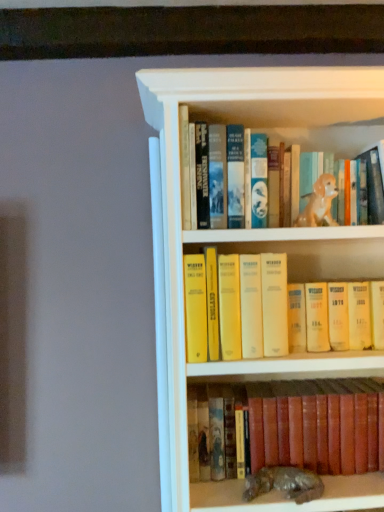
The image size is (384, 512). Identify the location of golden ceramic dog at upper center, which is the 2th animal in bottom-to-top order. (319, 203).

Considering the relative sizes of golden ceramic dog at upper center, acting as the 1th animal starting from the top, and shiny metallic statue at lower center, which is the 1th animal in bottom-to-top order, in the image provided, is golden ceramic dog at upper center, acting as the 1th animal starting from the top, shorter than shiny metallic statue at lower center, which is the 1th animal in bottom-to-top order,?

In fact, golden ceramic dog at upper center, acting as the 1th animal starting from the top, may be taller than shiny metallic statue at lower center, which is the 1th animal in bottom-to-top order.

Where is `animal lying in front of the shiny metallic statue at lower center, which is the second animal in top-to-bottom order`? The image size is (384, 512). animal lying in front of the shiny metallic statue at lower center, which is the second animal in top-to-bottom order is located at coordinates (319, 203).

From the picture: Does golden ceramic dog at upper center, which is the 2th animal in bottom-to-top order, lie in front of shiny metallic statue at lower center, which is the 1th animal in bottom-to-top order?

Yes, it is.

Which is more to the right, golden ceramic dog at upper center, acting as the 1th animal starting from the top, or shiny metallic statue at lower center, which is the 1th animal in bottom-to-top order?

From the viewer's perspective, golden ceramic dog at upper center, acting as the 1th animal starting from the top, appears more on the right side.

From a real-world perspective, is shiny metallic statue at lower center, which is the second animal in top-to-bottom order, positioned above or below golden ceramic dog at upper center, acting as the 1th animal starting from the top?

From a real-world perspective, shiny metallic statue at lower center, which is the second animal in top-to-bottom order, is physically below golden ceramic dog at upper center, acting as the 1th animal starting from the top.

Is golden ceramic dog at upper center, which is the 2th animal in bottom-to-top order, completely or partially inside shiny metallic statue at lower center, which is the second animal in top-to-bottom order?

No.

Identify the location of animal in front of the shiny metallic statue at lower center, which is the second animal in top-to-bottom order. (319, 203).

From the image's perspective, which is below, shiny metallic statue at lower center, which is the second animal in top-to-bottom order, or golden ceramic dog at upper center, which is the 2th animal in bottom-to-top order?

From the image's view, shiny metallic statue at lower center, which is the second animal in top-to-bottom order, is below.

Does shiny metallic statue at lower center, which is the second animal in top-to-bottom order, have a lesser width compared to yellow paperbacks at center, acting as the first book starting from the top?

Yes, shiny metallic statue at lower center, which is the second animal in top-to-bottom order, is thinner than yellow paperbacks at center, acting as the first book starting from the top.

Is point (293, 490) closer to camera compared to point (234, 347)?

No, (293, 490) is behind (234, 347).

From the picture: Is shiny metallic statue at lower center, which is the second animal in top-to-bottom order, facing towards yellow paperbacks at center, the 2th book positioned from the bottom?

No, shiny metallic statue at lower center, which is the second animal in top-to-bottom order, does not turn towards yellow paperbacks at center, the 2th book positioned from the bottom.

From a real-world perspective, who is located higher, shiny metallic statue at lower center, which is the second animal in top-to-bottom order, or yellow paperbacks at center, acting as the first book starting from the top?

yellow paperbacks at center, acting as the first book starting from the top, from a real-world perspective.

From a real-world perspective, is leather-bound book at lower center, which ranks as the second book in top-to-bottom order, located higher than golden ceramic dog at upper center, which is the 2th animal in bottom-to-top order?

No, from a real-world perspective, leather-bound book at lower center, which ranks as the second book in top-to-bottom order, is not over golden ceramic dog at upper center, which is the 2th animal in bottom-to-top order

Considering the positions of objects leather-bound book at lower center, which is the 1th book in bottom-to-top order, and golden ceramic dog at upper center, acting as the 1th animal starting from the top, in the image provided, who is more to the right, leather-bound book at lower center, which is the 1th book in bottom-to-top order, or golden ceramic dog at upper center, acting as the 1th animal starting from the top,?

From the viewer's perspective, golden ceramic dog at upper center, acting as the 1th animal starting from the top, appears more on the right side.

From a real-world perspective, starting from the golden ceramic dog at upper center, acting as the 1th animal starting from the top, which book is the 2nd one below it? Please provide its 2D coordinates.

[(317, 425)]

Does leather-bound book at lower center, which ranks as the second book in top-to-bottom order, have a larger size compared to golden ceramic dog at upper center, which is the 2th animal in bottom-to-top order?

Yes, leather-bound book at lower center, which ranks as the second book in top-to-bottom order, is bigger than golden ceramic dog at upper center, which is the 2th animal in bottom-to-top order.

Between yellow paperbacks at center, acting as the first book starting from the top, and leather-bound book at lower center, which is the 1th book in bottom-to-top order, which one is positioned behind?

leather-bound book at lower center, which is the 1th book in bottom-to-top order, is behind.

Would you say yellow paperbacks at center, acting as the first book starting from the top, is a long distance from leather-bound book at lower center, which ranks as the second book in top-to-bottom order?

Actually, yellow paperbacks at center, acting as the first book starting from the top, and leather-bound book at lower center, which ranks as the second book in top-to-bottom order, are a little close together.

Is yellow paperbacks at center, acting as the first book starting from the top, facing towards leather-bound book at lower center, which ranks as the second book in top-to-bottom order?

No.

Looking at this image, from a real-world perspective, between yellow paperbacks at center, acting as the first book starting from the top, and leather-bound book at lower center, which is the 1th book in bottom-to-top order, who is vertically lower?

leather-bound book at lower center, which is the 1th book in bottom-to-top order, is physically lower.

From a real-world perspective, which is physically below, shiny metallic statue at lower center, which is the second animal in top-to-bottom order, or leather-bound book at lower center, which is the 1th book in bottom-to-top order?

shiny metallic statue at lower center, which is the second animal in top-to-bottom order, from a real-world perspective.

You are a GUI agent. You are given a task and a screenshot of the screen. Output one action in this format:
    pyautogui.click(x=<x>, y=<y>)
    Task: Click on the 1st book above the shiny metallic statue at lower center, which is the second animal in top-to-bottom order (from the image's perspective)
    
    Given the screenshot: What is the action you would take?
    pyautogui.click(x=317, y=425)

From the image's perspective, does shiny metallic statue at lower center, which is the second animal in top-to-bottom order, appear lower than leather-bound book at lower center, which ranks as the second book in top-to-bottom order?

Yes, from the image's perspective, shiny metallic statue at lower center, which is the second animal in top-to-bottom order, is beneath leather-bound book at lower center, which ranks as the second book in top-to-bottom order.

Which of these two, shiny metallic statue at lower center, which is the second animal in top-to-bottom order, or leather-bound book at lower center, which is the 1th book in bottom-to-top order, stands shorter?

shiny metallic statue at lower center, which is the second animal in top-to-bottom order.

Choose the correct answer: Is yellow paperbacks at center, acting as the first book starting from the top, inside shiny metallic statue at lower center, which is the second animal in top-to-bottom order, or outside it?

yellow paperbacks at center, acting as the first book starting from the top, is not inside shiny metallic statue at lower center, which is the second animal in top-to-bottom order, it's outside.

Consider the image. From the image's perspective, which one is positioned higher, yellow paperbacks at center, acting as the first book starting from the top, or shiny metallic statue at lower center, which is the 1th animal in bottom-to-top order?

yellow paperbacks at center, acting as the first book starting from the top, from the image's perspective.

The width and height of the screenshot is (384, 512). I want to click on animal below the yellow paperbacks at center, the 2th book positioned from the bottom (from the image's perspective), so click(x=284, y=483).

Is yellow paperbacks at center, the 2th book positioned from the bottom, to the left or to the right of shiny metallic statue at lower center, which is the second animal in top-to-bottom order, in the image?

yellow paperbacks at center, the 2th book positioned from the bottom, is positioned on shiny metallic statue at lower center, which is the second animal in top-to-bottom order,'s left side.

This screenshot has height=512, width=384. I want to click on animal on the left of golden ceramic dog at upper center, acting as the 1th animal starting from the top, so click(x=284, y=483).

Locate an element on the screen. animal below the golden ceramic dog at upper center, acting as the 1th animal starting from the top (from the image's perspective) is located at coordinates (284, 483).

Which object lies further to the anchor point leather-bound book at lower center, which is the 1th book in bottom-to-top order, golden ceramic dog at upper center, which is the 2th animal in bottom-to-top order, or shiny metallic statue at lower center, which is the 1th animal in bottom-to-top order?

Among the two, golden ceramic dog at upper center, which is the 2th animal in bottom-to-top order, is located further to leather-bound book at lower center, which is the 1th book in bottom-to-top order.

Consider the image. Which object lies nearer to the anchor point shiny metallic statue at lower center, which is the 1th animal in bottom-to-top order, yellow paperbacks at center, the 2th book positioned from the bottom, or golden ceramic dog at upper center, acting as the 1th animal starting from the top?

Among the two, yellow paperbacks at center, the 2th book positioned from the bottom, is located nearer to shiny metallic statue at lower center, which is the 1th animal in bottom-to-top order.

Estimate the real-world distances between objects in this image. Which object is closer to leather-bound book at lower center, which is the 1th book in bottom-to-top order, shiny metallic statue at lower center, which is the 1th animal in bottom-to-top order, or golden ceramic dog at upper center, which is the 2th animal in bottom-to-top order?

shiny metallic statue at lower center, which is the 1th animal in bottom-to-top order, lies closer to leather-bound book at lower center, which is the 1th book in bottom-to-top order, than the other object.

Based on their spatial positions, is shiny metallic statue at lower center, which is the second animal in top-to-bottom order, or leather-bound book at lower center, which is the 1th book in bottom-to-top order, closer to golden ceramic dog at upper center, acting as the 1th animal starting from the top?

Based on the image, leather-bound book at lower center, which is the 1th book in bottom-to-top order, appears to be nearer to golden ceramic dog at upper center, acting as the 1th animal starting from the top.

Consider the image. From the image, which object appears to be farther from golden ceramic dog at upper center, acting as the 1th animal starting from the top, shiny metallic statue at lower center, which is the second animal in top-to-bottom order, or yellow paperbacks at center, acting as the first book starting from the top?

Among the two, shiny metallic statue at lower center, which is the second animal in top-to-bottom order, is located further to golden ceramic dog at upper center, acting as the 1th animal starting from the top.

Considering their positions, is shiny metallic statue at lower center, which is the 1th animal in bottom-to-top order, positioned closer to yellow paperbacks at center, acting as the first book starting from the top, than leather-bound book at lower center, which is the 1th book in bottom-to-top order?

leather-bound book at lower center, which is the 1th book in bottom-to-top order, is closer to yellow paperbacks at center, acting as the first book starting from the top.

Looking at the image, which one is located closer to golden ceramic dog at upper center, which is the 2th animal in bottom-to-top order, leather-bound book at lower center, which ranks as the second book in top-to-bottom order, or shiny metallic statue at lower center, which is the 1th animal in bottom-to-top order?

leather-bound book at lower center, which ranks as the second book in top-to-bottom order, is closer to golden ceramic dog at upper center, which is the 2th animal in bottom-to-top order.

Considering their positions, is golden ceramic dog at upper center, acting as the 1th animal starting from the top, positioned further to leather-bound book at lower center, which ranks as the second book in top-to-bottom order, than yellow paperbacks at center, the 2th book positioned from the bottom?

The object further to leather-bound book at lower center, which ranks as the second book in top-to-bottom order, is golden ceramic dog at upper center, acting as the 1th animal starting from the top.

Image resolution: width=384 pixels, height=512 pixels. I want to click on book between golden ceramic dog at upper center, which is the 2th animal in bottom-to-top order, and leather-bound book at lower center, which is the 1th book in bottom-to-top order, in the vertical direction, so click(x=334, y=311).

At what (x,y) coordinates should I click in order to perform the action: click on book between yellow paperbacks at center, the 2th book positioned from the bottom, and shiny metallic statue at lower center, which is the second animal in top-to-bottom order, from top to bottom. Please return your answer as a coordinate pair (x, y). The height and width of the screenshot is (512, 384). Looking at the image, I should click on pyautogui.click(x=317, y=425).